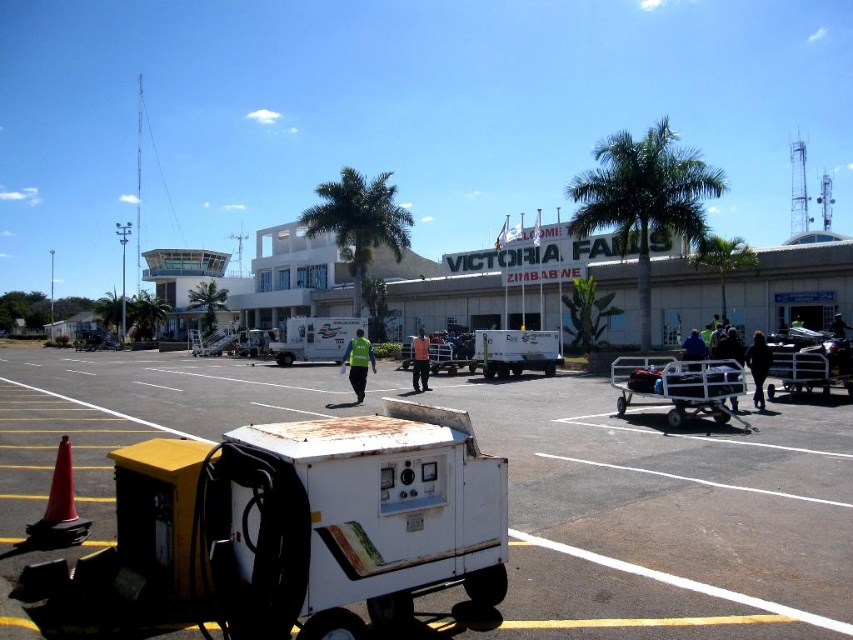
Question: Is metallic luggage cart at center smaller than yellow reflective vest at center?

Choices:
 (A) no
 (B) yes

Answer: (A)

Question: Which point appears closest to the camera in this image?

Choices:
 (A) (531, 381)
 (B) (412, 371)
 (C) (734, 378)
 (D) (773, 396)

Answer: (C)

Question: Is metallic silver luggage cart at center closer to the viewer compared to white matte truck at center?

Choices:
 (A) no
 (B) yes

Answer: (B)

Question: Which object is positioned closest to the dark blue uniform at center?

Choices:
 (A) white matte generator at center
 (B) black fabric person at center

Answer: (B)

Question: Estimate the real-world distances between objects in this image. Which object is farther from the dark blue uniform at center?

Choices:
 (A) black fabric person at center
 (B) yellow reflective vest at center
 (C) metallic silver luggage cart at center
 (D) white matte food truck at center

Answer: (D)

Question: Does black fabric person at center appear under dark blue uniform at center?

Choices:
 (A) yes
 (B) no

Answer: (A)